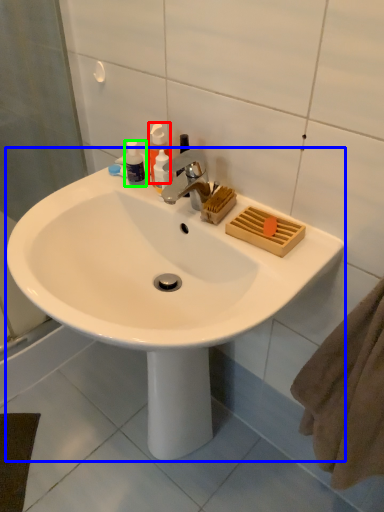
Question: Which object is the farthest from soap dispenser (highlighted by a red box)? Choose among these: sink (highlighted by a blue box) or toiletry (highlighted by a green box).

Choices:
 (A) sink
 (B) toiletry

Answer: (A)